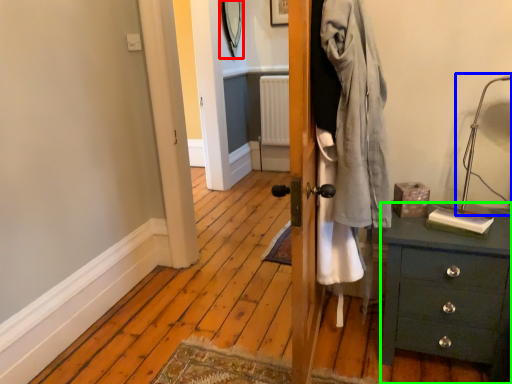
Question: Which is nearer to the mirror (highlighted by a red box)? table lamp (highlighted by a blue box) or chest of drawers (highlighted by a green box).

Choices:
 (A) table lamp
 (B) chest of drawers

Answer: (A)